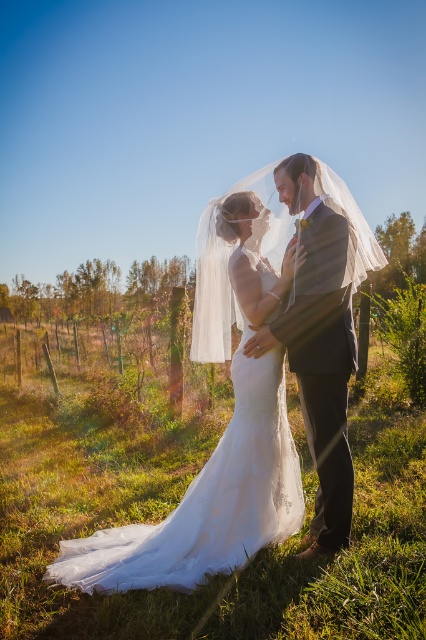
Question: Which of the following is the farthest from the observer?

Choices:
 (A) (247, 481)
 (B) (201, 268)

Answer: (B)

Question: Is white lace dress at center positioned before white sheer veil at center?

Choices:
 (A) no
 (B) yes

Answer: (B)

Question: Which point is closer to the camera?

Choices:
 (A) white lace dress at center
 (B) white sheer veil at center

Answer: (A)

Question: Is white lace dress at center below white sheer veil at center?

Choices:
 (A) yes
 (B) no

Answer: (A)

Question: Is white lace dress at center thinner than white sheer veil at center?

Choices:
 (A) no
 (B) yes

Answer: (A)